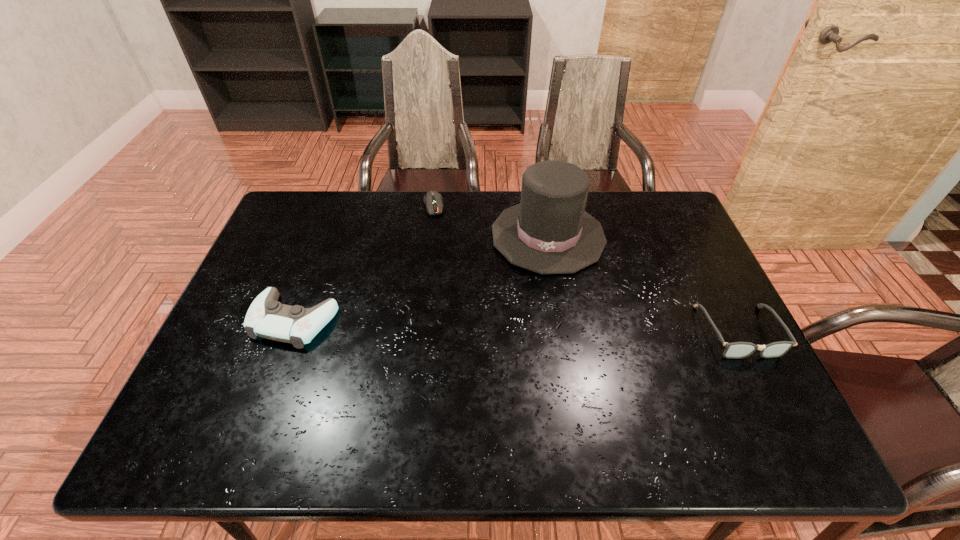
The width and height of the screenshot is (960, 540). In order to click on free space located 0.140m on the front of the tallest object with the decoration in this screenshot , I will do `click(535, 312)`.

You are a GUI agent. You are given a task and a screenshot of the screen. Output one action in this format:
    pyautogui.click(x=<x>, y=<y>)
    Task: Click on the vacant space located on the button of the computer equipment
    
    Given the screenshot: What is the action you would take?
    pyautogui.click(x=442, y=259)

This screenshot has height=540, width=960. What are the coordinates of `vacant space located 0.210m on the button of the computer equipment` in the screenshot? It's located at (442, 259).

You are a GUI agent. You are given a task and a screenshot of the screen. Output one action in this format:
    pyautogui.click(x=<x>, y=<y>)
    Task: Click on the vacant space located on the button of the computer equipment
    The height and width of the screenshot is (540, 960).
    Given the screenshot: What is the action you would take?
    pyautogui.click(x=439, y=242)

The width and height of the screenshot is (960, 540). I want to click on dress hat at the far edge, so click(x=549, y=232).

This screenshot has height=540, width=960. Identify the location of computer equipment that is at the far edge. (433, 200).

This screenshot has height=540, width=960. Identify the location of object that is at the left edge. (266, 317).

The height and width of the screenshot is (540, 960). Identify the location of object present at the right edge. (736, 350).

Locate an element on the screen. free space at the far edge of the desktop is located at coordinates (402, 228).

Image resolution: width=960 pixels, height=540 pixels. Find the location of `free location at the near edge`. free location at the near edge is located at coordinates (458, 378).